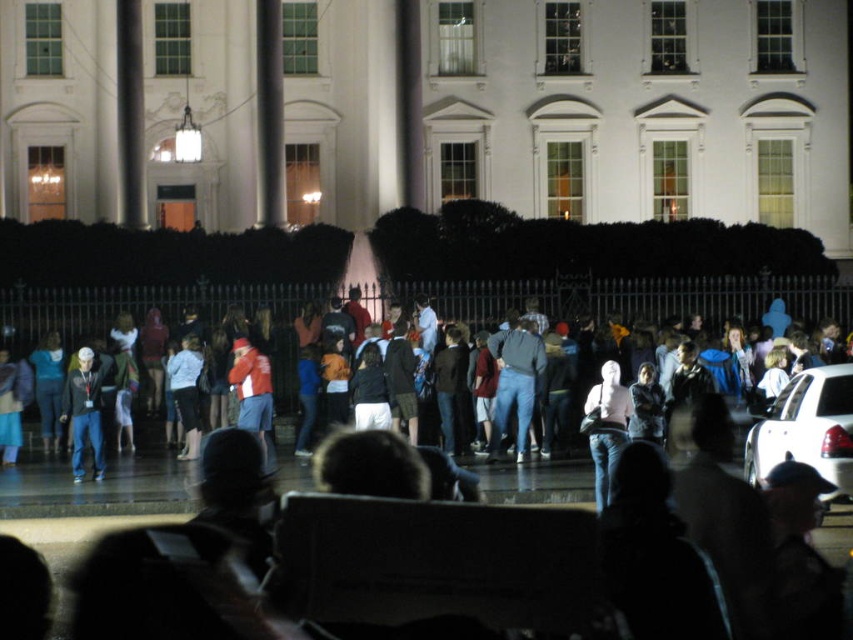
You are a photographer standing in the crowd in front of the White House fence. You want to take a photo of the building but notice two jackets in your viewfinder. The denim jacket at center and the matte black jacket at left are blocking your view. Which jacket is taller and might be blocking more of the White House facade?

The denim jacket at center is taller than the matte black jacket at left, so it might be blocking more of the White House facade.

From the picture: You are standing at the center of the image and want to locate the denim jacket at center. According to the coordinates provided, in which direction should you look to find it?

The denim jacket at center is located at coordinates point (653, 305). Since you are at the center, which is typically considered as point (426, 320), the denim jacket at center is slightly to the left and above your current position. Therefore, you should look slightly to the left and upwards to locate it.

You are a photographer standing behind the crowd, wanting to take a photo of the White House. You notice a denim jacket at center and a matte black jacket at left in the foreground. Which jacket is blocking your view more to the right?

The denim jacket at center is positioned on the right side of the matte black jacket at left, so it is blocking your view more to the right.